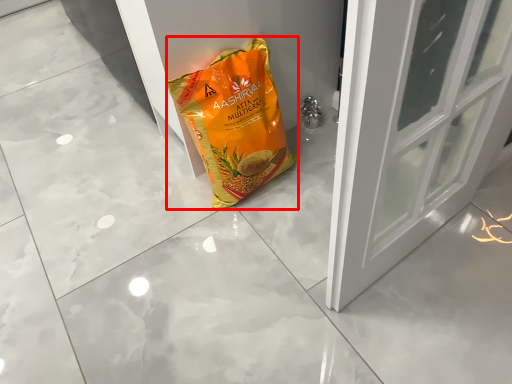
Question: From the image's perspective, what is the correct spatial relationship of plastic bag (annotated by the red box) in relation to door?

Choices:
 (A) above
 (B) below

Answer: (B)